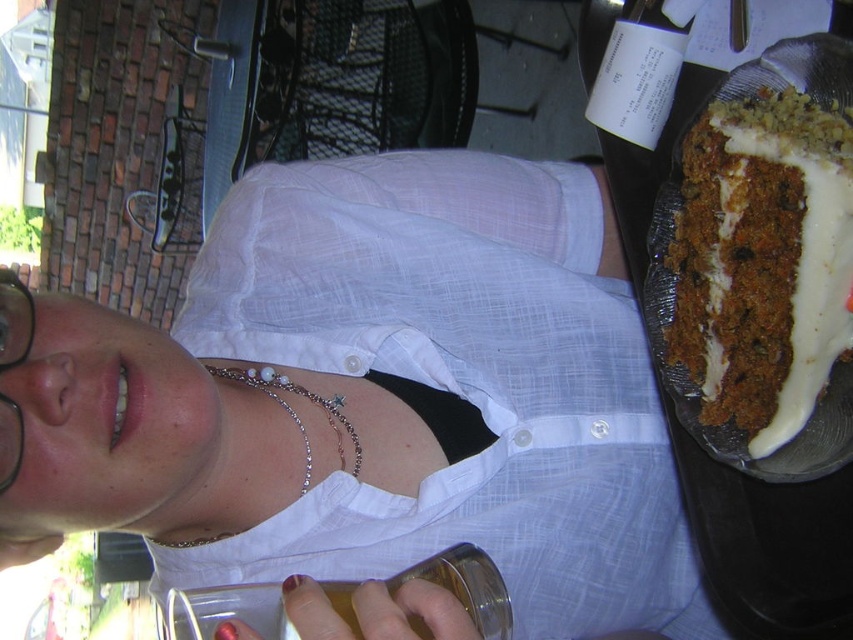
Between white matte shirt at upper center and carrot cake with cream cheese frosting at right, which one appears on the left side from the viewer's perspective?

Positioned to the left is white matte shirt at upper center.

Who is positioned more to the right, white matte shirt at upper center or carrot cake with cream cheese frosting at right?

From the viewer's perspective, carrot cake with cream cheese frosting at right appears more on the right side.

What do you see at coordinates (374, 397) in the screenshot?
I see `white matte shirt at upper center` at bounding box center [374, 397].

The height and width of the screenshot is (640, 853). In order to click on white matte shirt at upper center in this screenshot , I will do `click(374, 397)`.

Does carrot cake with cream cheese frosting at right have a smaller size compared to black plastic glasses at upper left?

Incorrect, carrot cake with cream cheese frosting at right is not smaller in size than black plastic glasses at upper left.

This screenshot has width=853, height=640. What do you see at coordinates (762, 260) in the screenshot?
I see `carrot cake with cream cheese frosting at right` at bounding box center [762, 260].

You are a GUI agent. You are given a task and a screenshot of the screen. Output one action in this format:
    pyautogui.click(x=<x>, y=<y>)
    Task: Click on the carrot cake with cream cheese frosting at right
    
    Given the screenshot: What is the action you would take?
    pyautogui.click(x=762, y=260)

Looking at this image, is white matte shirt at upper center to the right of black plastic glasses at upper left from the viewer's perspective?

Correct, you'll find white matte shirt at upper center to the right of black plastic glasses at upper left.

Measure the distance between white matte shirt at upper center and black plastic glasses at upper left.

The distance of white matte shirt at upper center from black plastic glasses at upper left is 11.47 inches.

This screenshot has width=853, height=640. I want to click on white matte shirt at upper center, so click(x=374, y=397).